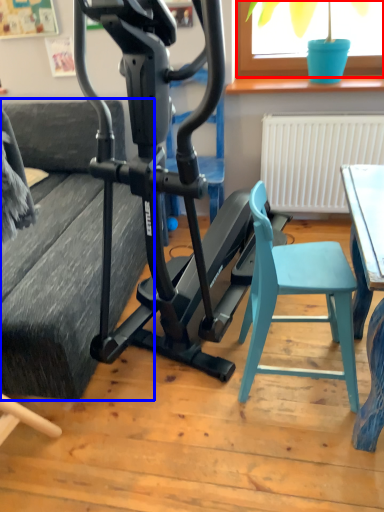
Question: Which point is closer to the camera, window screen (highlighted by a red box) or couch (highlighted by a blue box)?

Choices:
 (A) window screen
 (B) couch

Answer: (B)